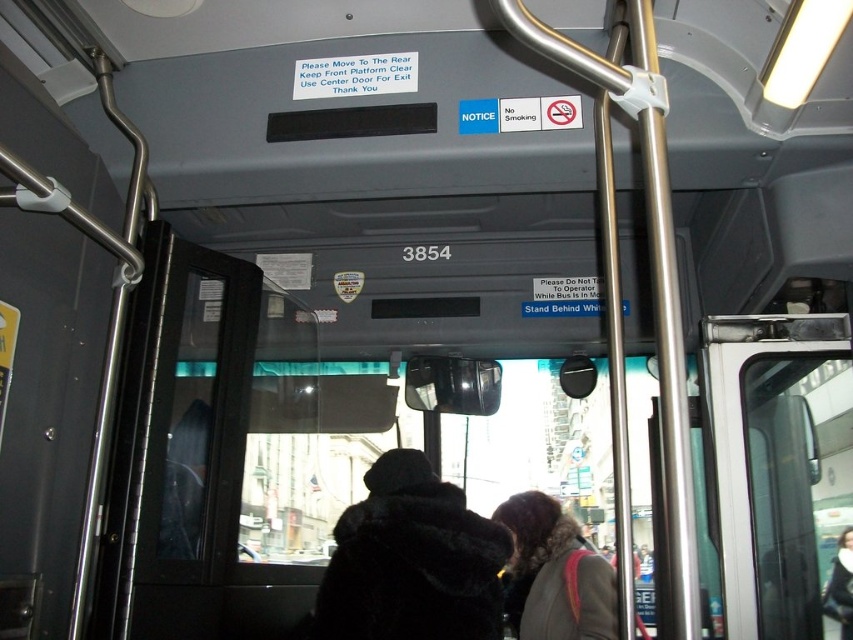
You are a passenger on the bus and you have a 12 inch wide backpack. You want to place it between the black fur coat at center and the dark brown fur coat at center. Will it fit?

The distance between the black fur coat at center and the dark brown fur coat at center is 18.67 inches. Since your backpack is 12 inches wide, there is enough space to place it between them.